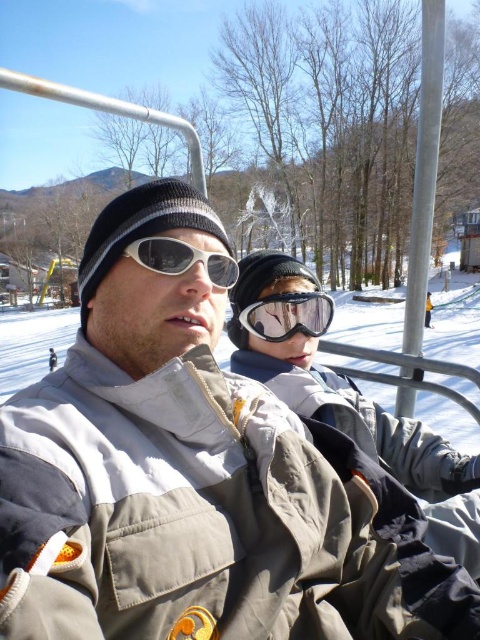
You are a photographer trying to capture a closeup of the transparent plastic goggles at center and the white matte goggles at center. Which goggles are positioned lower in the image?

The transparent plastic goggles at center are positioned lower than the white matte goggles at center in the image.

You are a photographer trying to capture a closeup of the transparent plastic goggles at center and white matte goggles at center. Which goggles are positioned to the right side of the other?

The transparent plastic goggles at center is to the right of white matte goggles at center.